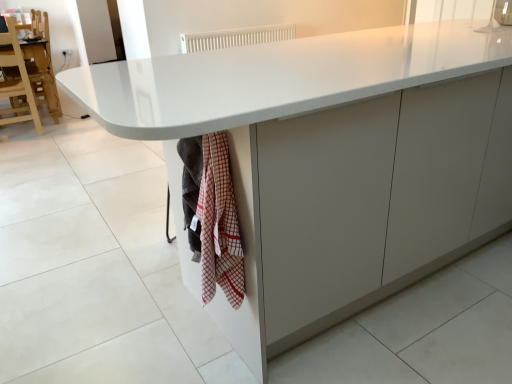
Identify the location of blank space situated above white plastic radiator at upper center (from a real-world perspective). This screenshot has width=512, height=384. (253, 24).